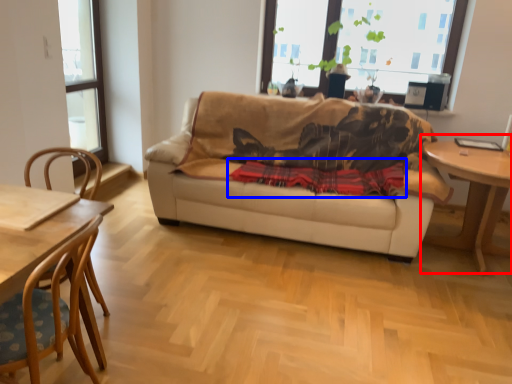
Question: Among these objects, which one is farthest to the camera, table (highlighted by a red box) or plaid (highlighted by a blue box)?

Choices:
 (A) table
 (B) plaid

Answer: (B)